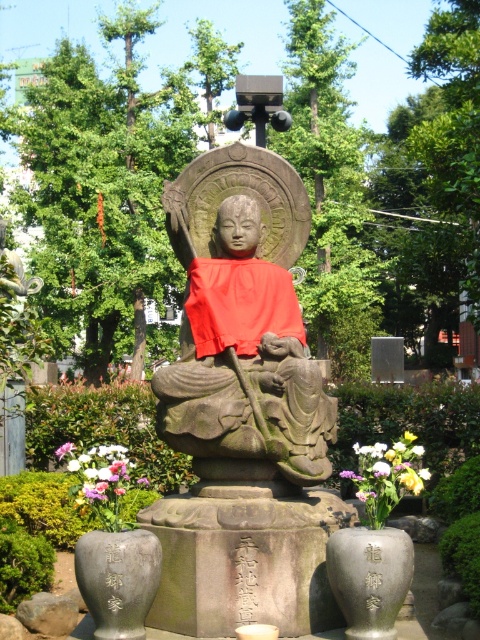
You are a gardener who wants to place a new pink fabric flower between the existing pink fabric flowers at lower left and the pink fabric flower at center. Given that the minimum spacing between flowers should be 10 feet for proper growth, is this placement feasible?

The distance between the pink fabric flowers at lower left and the pink fabric flower at center is 9.88 feet, which is less than the required 10 feet. Therefore, placing a new flower between them would not meet the spacing requirement.

Based on the photo, you are standing in front of the stone statue and want to place a small offering. The pedestal has a rectangular base. Where should you place the offering so it is closest to the pink fabric flowers at lower left?

The pink fabric flowers at lower left are located at point [99,472], so you should place the offering near that coordinate to be closest to them.